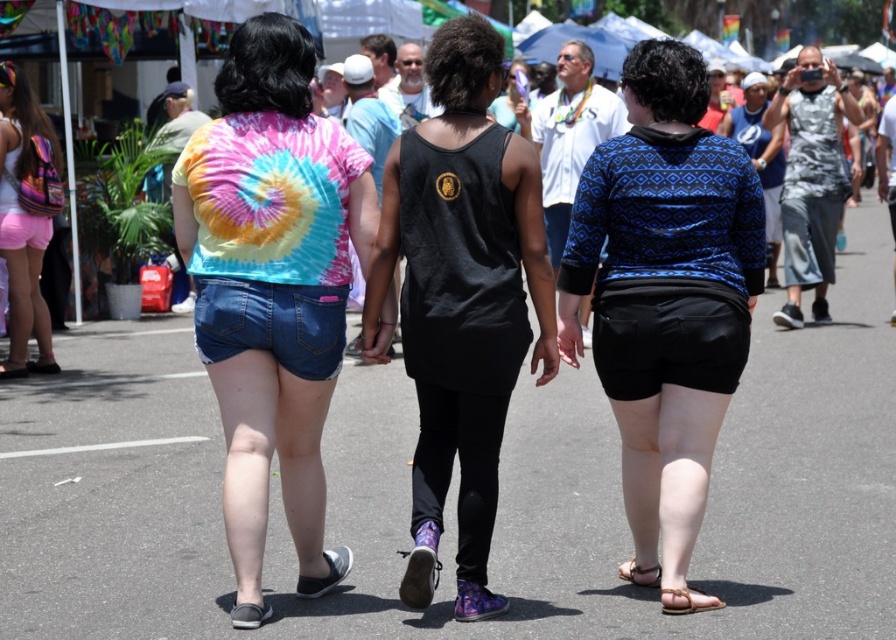
You are trying to decide which item to grab quickly from your bag. The blue printed sweater at center and the brown leather sandal at lower right are both in your bag. Which one is wider?

The blue printed sweater at center is wider than the brown leather sandal at lower right because the blue printed sweater at center has a larger width according to the description.

You are standing at the center of the scene and want to pick up the matte pink shorts at left and the brown leather sandal at lower right. Which object is closer to your current position?

The matte pink shorts at left is located above the brown leather sandal at lower right, so the brown leather sandal at lower right is closer to your current position.